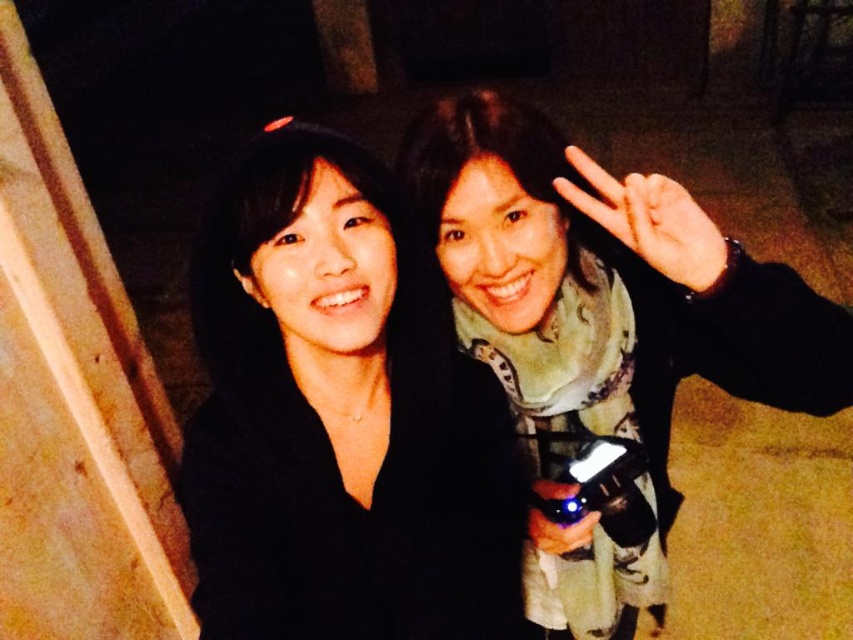
Is black matte jacket at center thinner than matte black camera at right?

Yes, black matte jacket at center is thinner than matte black camera at right.

Is black matte jacket at center shorter than matte black camera at right?

Yes.

Which is behind, point (190, 538) or point (659, 376)?

The point (190, 538) is more distant.

The height and width of the screenshot is (640, 853). I want to click on black matte jacket at center, so click(x=339, y=417).

Does point (553, 572) lie in front of point (549, 538)?

No, (553, 572) is behind (549, 538).

Is matte black camera at right to the right of matte black flashlight at lower center from the viewer's perspective?

Correct, you'll find matte black camera at right to the right of matte black flashlight at lower center.

Locate an element on the screen. The width and height of the screenshot is (853, 640). matte black camera at right is located at coordinates (604, 321).

Where is `matte black camera at right`? The width and height of the screenshot is (853, 640). matte black camera at right is located at coordinates (604, 321).

Can you confirm if black matte jacket at center is taller than matte black flashlight at lower center?

Yes, black matte jacket at center is taller than matte black flashlight at lower center.

In the scene shown: Does black matte jacket at center appear over matte black flashlight at lower center?

Indeed, black matte jacket at center is positioned over matte black flashlight at lower center.

Measure the distance between black matte jacket at center and camera.

A distance of 34.80 inches exists between black matte jacket at center and camera.

Where is `black matte jacket at center`? The image size is (853, 640). black matte jacket at center is located at coordinates (339, 417).